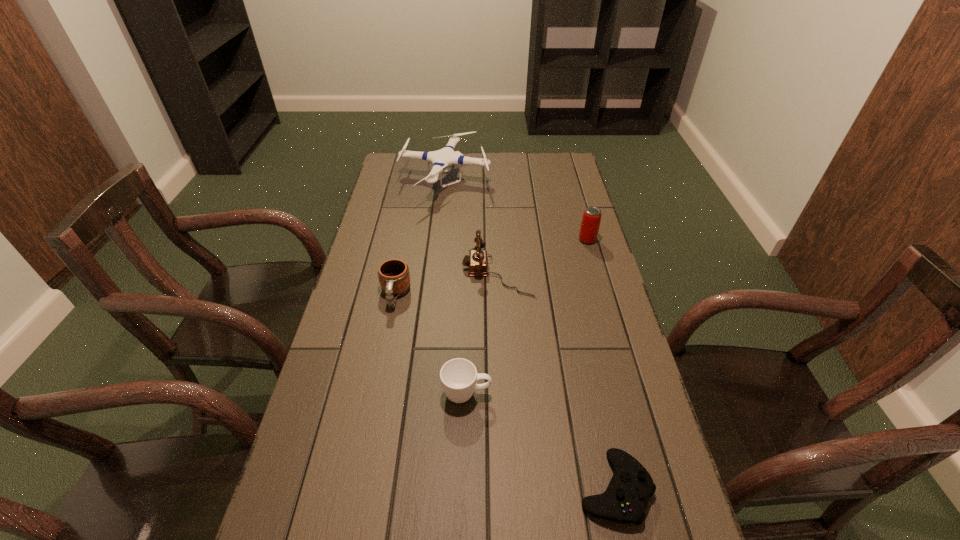
The image size is (960, 540). Identify the location of empty space between the second farthest object and the control. (601, 363).

Locate an element on the screen. This screenshot has width=960, height=540. free spot between the drone and the mug is located at coordinates (420, 239).

Find the location of a particular element. The width and height of the screenshot is (960, 540). vacant region between the drone and the second nearest object is located at coordinates (456, 288).

Identify the location of free space between the mug and the telephone. The width and height of the screenshot is (960, 540). (446, 284).

What are the coordinates of `vacant point located between the second farthest object and the shortest object` in the screenshot? It's located at click(601, 363).

Where is `free space between the shortest object and the mug`? This screenshot has height=540, width=960. free space between the shortest object and the mug is located at coordinates (505, 391).

Identify which object is the fourth nearest to the drone. Please provide its 2D coordinates. Your answer should be formatted as a tuple, i.e. [(x, y)], where the tuple contains the x and y coordinates of a point satisfying the conditions above.

[(458, 376)]

Locate an element on the screen. object that is the second closest to the farthest object is located at coordinates (591, 219).

Locate an element on the screen. The height and width of the screenshot is (540, 960). free space that satisfies the following two spatial constraints: 1. on the side of the mug with the handle; 2. on the left side of the control is located at coordinates point(357,488).

Locate an element on the screen. The height and width of the screenshot is (540, 960). blank space that satisfies the following two spatial constraints: 1. on the dial of the telephone; 2. on the side of the mug with the handle is located at coordinates (498, 295).